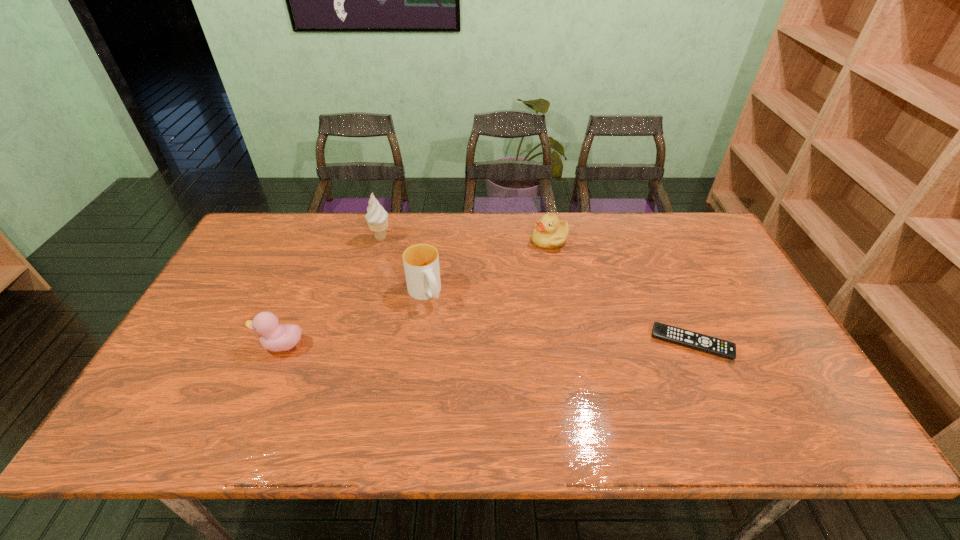
Where is `blank space located 0.340m on the front-facing side of the farther duckling`? blank space located 0.340m on the front-facing side of the farther duckling is located at coordinates pos(479,314).

At what (x,y) coordinates should I click in order to perform the action: click on free space located on the front-facing side of the farther duckling. Please return your answer as a coordinate pair (x, y). Looking at the image, I should click on (490, 303).

Where is `vacant point located 0.100m on the front-facing side of the farther duckling`? This screenshot has height=540, width=960. vacant point located 0.100m on the front-facing side of the farther duckling is located at coordinates (524, 267).

Locate an element on the screen. icecream that is at the far edge is located at coordinates (377, 218).

Find the location of a particular element. The image size is (960, 540). duckling at the far edge is located at coordinates (549, 233).

Find the location of a particular element. This screenshot has width=960, height=540. object that is at the right edge is located at coordinates (679, 336).

In the image, there is a desktop. Where is `free space at the far edge`? The image size is (960, 540). free space at the far edge is located at coordinates (415, 231).

The height and width of the screenshot is (540, 960). Find the location of `free space at the near edge of the desktop`. free space at the near edge of the desktop is located at coordinates (564, 376).

At what (x,y) coordinates should I click in order to perform the action: click on vacant space at the right edge of the desktop. Please return your answer as a coordinate pair (x, y). The height and width of the screenshot is (540, 960). Looking at the image, I should click on (x=696, y=299).

In order to click on blank space at the far left corner of the desktop in this screenshot , I will do `click(247, 238)`.